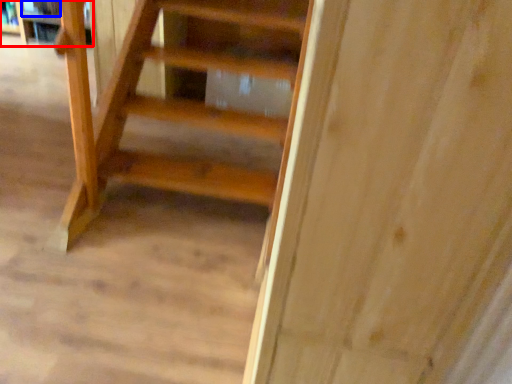
Question: Which object is closer to the camera taking this photo, shelf (highlighted by a red box) or book (highlighted by a blue box)?

Choices:
 (A) shelf
 (B) book

Answer: (A)